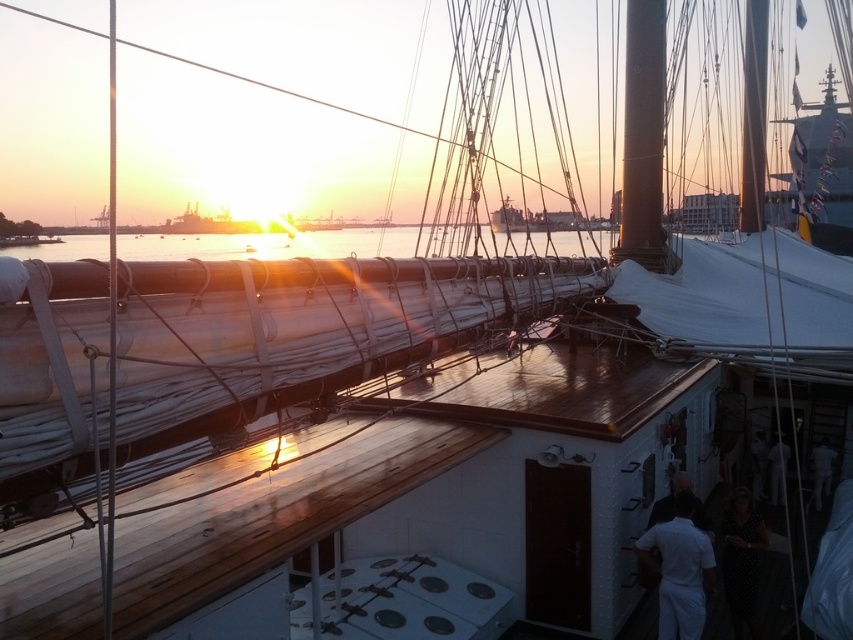
Question: Does shiny metallic water at center appear on the right side of metallic polished mast at upper center?

Choices:
 (A) yes
 (B) no

Answer: (B)

Question: Can you confirm if shiny metallic water at center is thinner than metallic polished mast at upper center?

Choices:
 (A) yes
 (B) no

Answer: (B)

Question: Estimate the real-world distances between objects in this image. Which object is farther from the shiny metallic water at center?

Choices:
 (A) metallic polished mast at upper center
 (B) smooth brown wood mast at upper center

Answer: (B)

Question: Is the position of shiny metallic water at center more distant than that of metallic polished mast at upper center?

Choices:
 (A) no
 (B) yes

Answer: (A)

Question: Which point is farther to the camera?

Choices:
 (A) (567, 248)
 (B) (749, 157)
 (C) (651, 106)

Answer: (A)

Question: Estimate the real-world distances between objects in this image. Which object is farther from the metallic polished mast at upper center?

Choices:
 (A) shiny metallic water at center
 (B) smooth brown wood mast at upper center

Answer: (A)